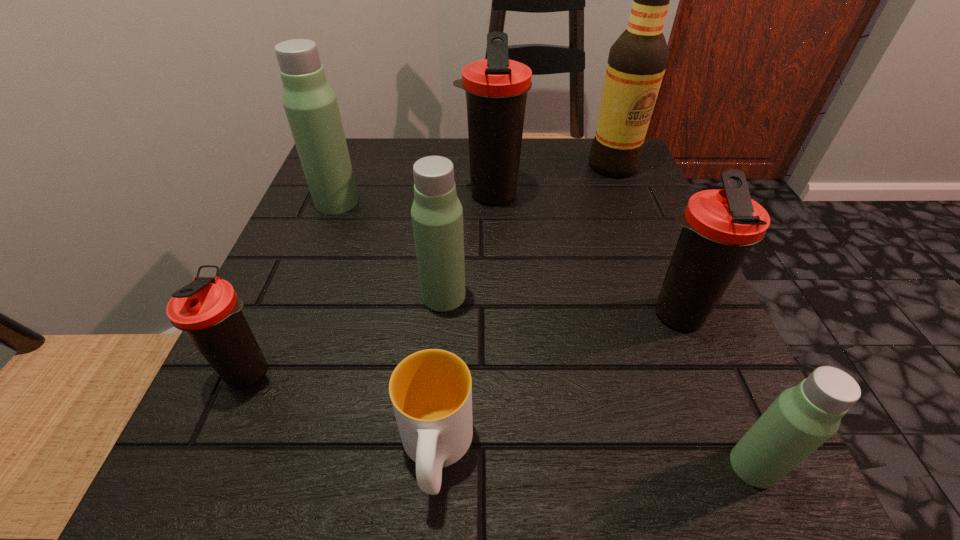
Choose which brown thermos bottle is the nearest neighbor to the second farthest light thermos bottle. Please provide its 2D coordinates. Your answer should be formatted as a tuple, i.e. [(x, y)], where the tuple contains the x and y coordinates of a point satisfying the conditions above.

[(496, 88)]

At what (x,y) coordinates should I click in order to perform the action: click on light thermos bottle that can be found as the closest to the shortest object. Please return your answer as a coordinate pair (x, y). Looking at the image, I should click on (437, 215).

Locate which light thermos bottle ranks second in proximity to the smallest brown thermos bottle. Please provide its 2D coordinates. Your answer should be formatted as a tuple, i.e. [(x, y)], where the tuple contains the x and y coordinates of a point satisfying the conditions above.

[(310, 104)]

This screenshot has width=960, height=540. Identify the location of vacant position in the image that satisfies the following two spatial constraints: 1. on the back side of the biggest light thermos bottle; 2. on the right side of the farthest brown thermos bottle. [x=340, y=194].

I want to click on vacant space that satisfies the following two spatial constraints: 1. on the back side of the second biggest brown thermos bottle; 2. on the left side of the smallest brown thermos bottle, so click(x=274, y=315).